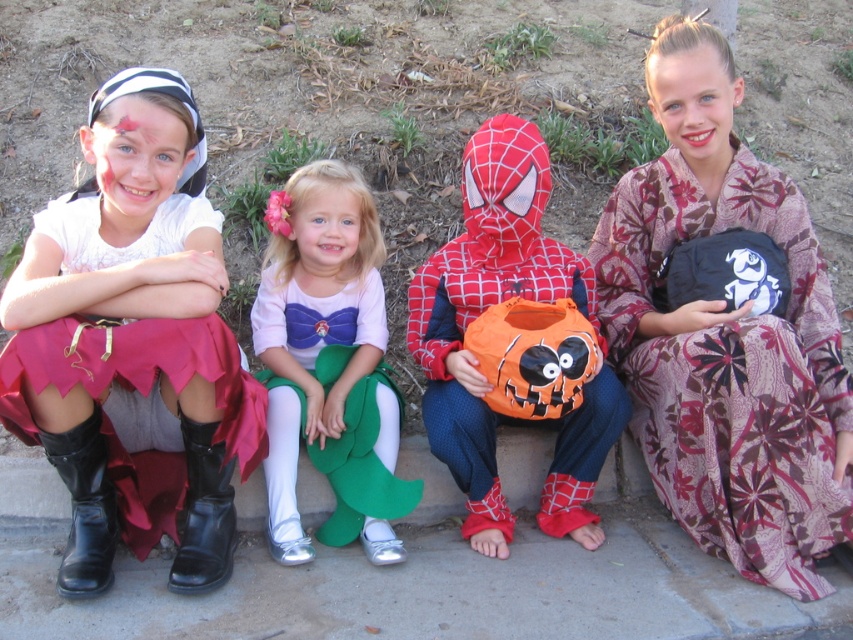
You are a photographer trying to capture a clear shot of the matte black boots at lower left and the pink satin dress at center. Which object should you focus on first if you want to ensure both are in focus?

The matte black boots at lower left is taller than the pink satin dress at center, so focusing on the taller matte black boots at lower left first will help ensure both are in focus.

You are a delivery person trying to deliver a package to the black fabric bag at right. The GPS shows that the black fabric bag at right is located at point (730, 374). If you are standing at the origin point at the bottom left corner of the image, which direction should you move to reach the black fabric bag at right?

The black fabric bag at right is located at point (730, 374). Since the origin is at the bottom left corner, moving towards the right and slightly upwards will reach the coordinates.